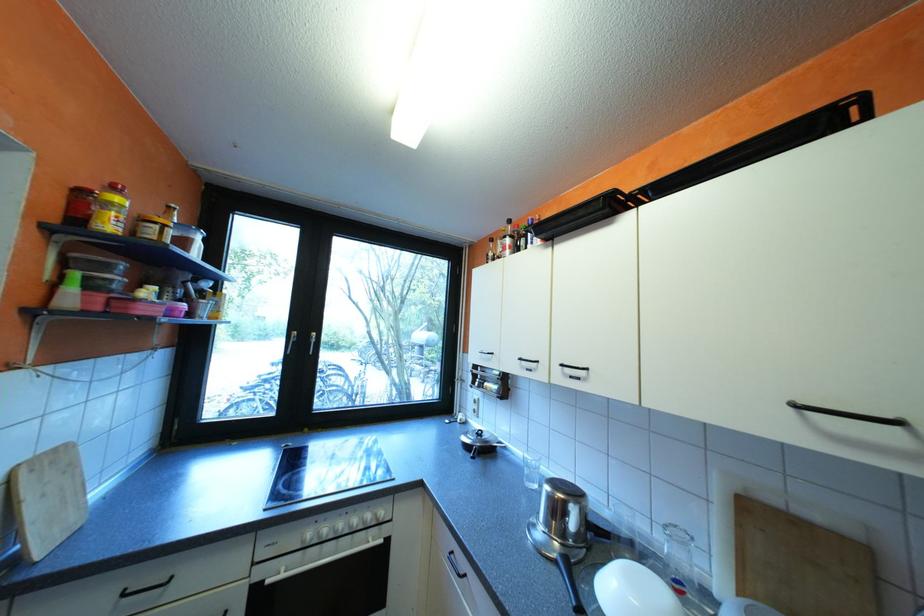
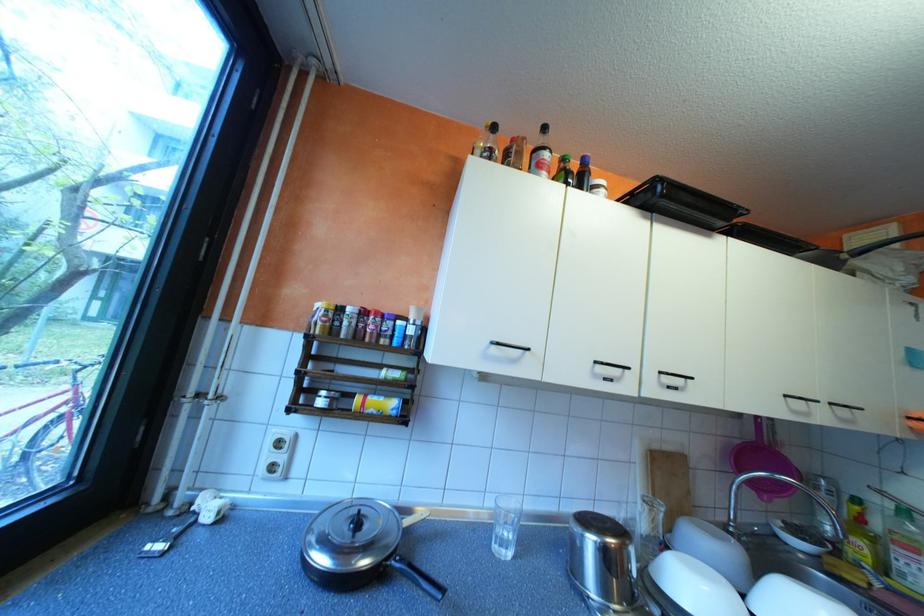
In the second image, find the point that corresponds to pixel 576 373 in the first image.

(673, 383)